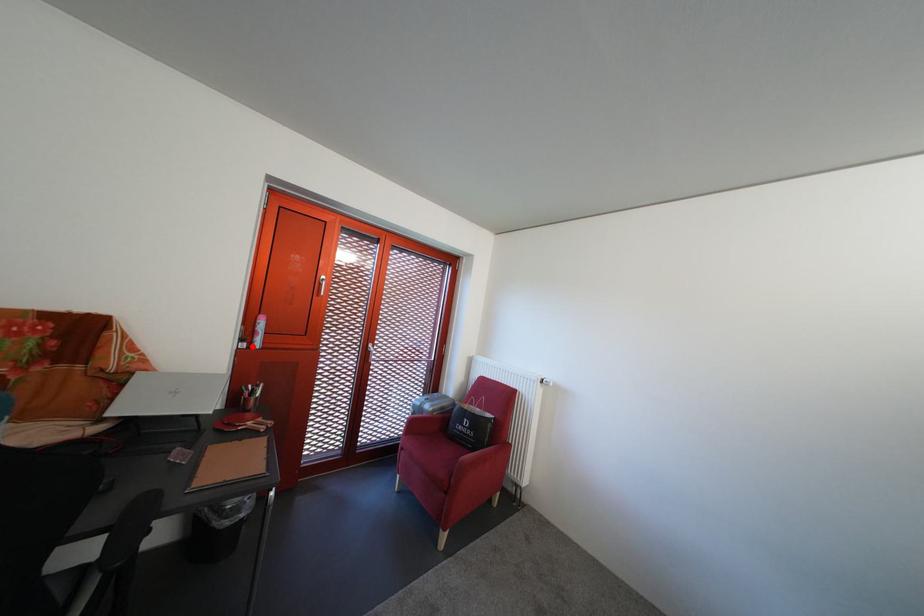
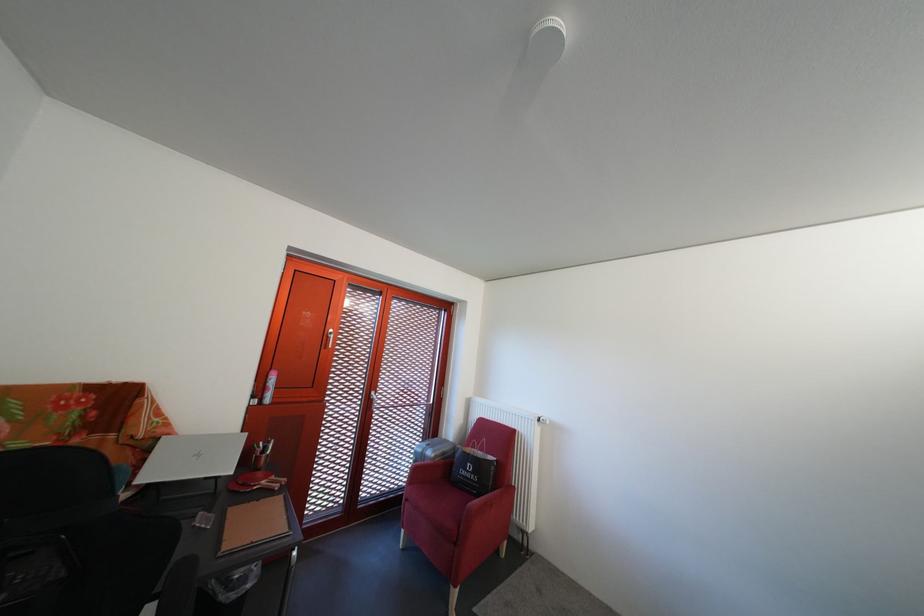
Find the pixel in the second image that matches the highlighted location in the first image.

(263, 403)